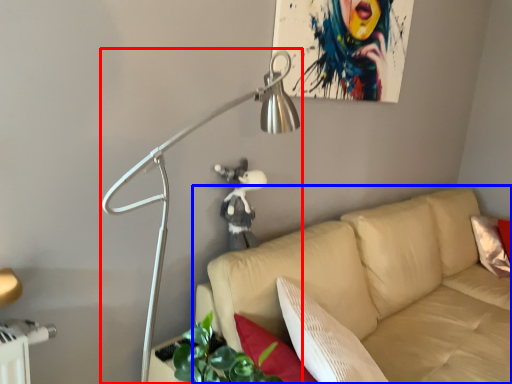
Question: Among these objects, which one is nearest to the camera, lamp (highlighted by a red box) or studio couch (highlighted by a blue box)?

Choices:
 (A) lamp
 (B) studio couch

Answer: (A)